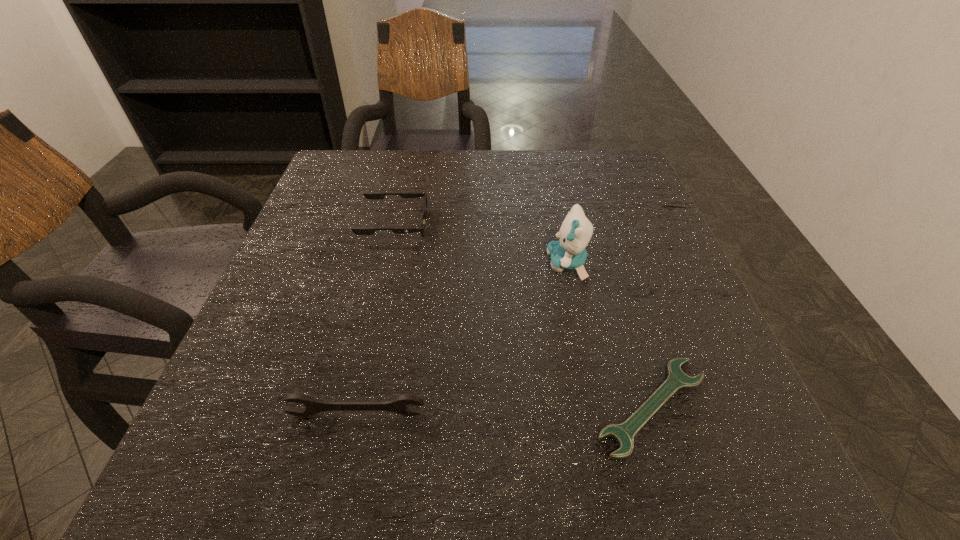
Identify the location of free space located 0.120m on the face of the third nearest object. The height and width of the screenshot is (540, 960). (489, 264).

Where is `free space located on the open ends of the taller wrench`? The height and width of the screenshot is (540, 960). free space located on the open ends of the taller wrench is located at coordinates (344, 471).

Find the location of `vacant position located 0.340m on the temples of the farthest object`. vacant position located 0.340m on the temples of the farthest object is located at coordinates (579, 225).

You are a GUI agent. You are given a task and a screenshot of the screen. Output one action in this format:
    pyautogui.click(x=<x>, y=<y>)
    Task: Click on the vacant space located on the left of the shorter wrench
    
    Given the screenshot: What is the action you would take?
    pyautogui.click(x=557, y=406)

Where is `object that is at the near edge`? The height and width of the screenshot is (540, 960). object that is at the near edge is located at coordinates (624, 433).

This screenshot has height=540, width=960. Find the location of `wrench located at the left edge`. wrench located at the left edge is located at coordinates (399, 404).

Find the location of a particular element. sunglasses present at the left edge is located at coordinates (369, 195).

Locate an element on the screen. The height and width of the screenshot is (540, 960). object present at the right edge is located at coordinates (624, 433).

Locate an element on the screen. The height and width of the screenshot is (540, 960). object that is at the near right corner is located at coordinates (624, 433).

The height and width of the screenshot is (540, 960). Identify the location of vacant space at the far edge of the desktop. (391, 167).